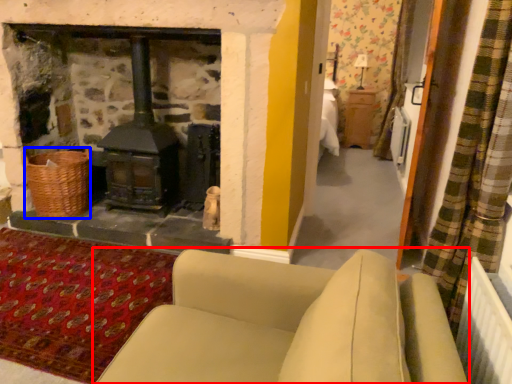
Question: Which object is further to the camera taking this photo, studio couch (highlighted by a red box) or basket (highlighted by a blue box)?

Choices:
 (A) studio couch
 (B) basket

Answer: (B)